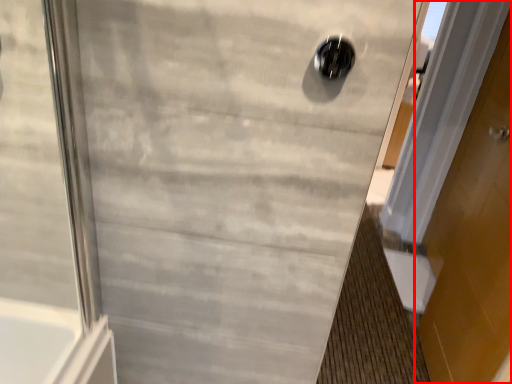
Question: From the image's perspective, what is the correct spatial relationship of door (annotated by the red box) in relation to hole?

Choices:
 (A) above
 (B) below

Answer: (B)